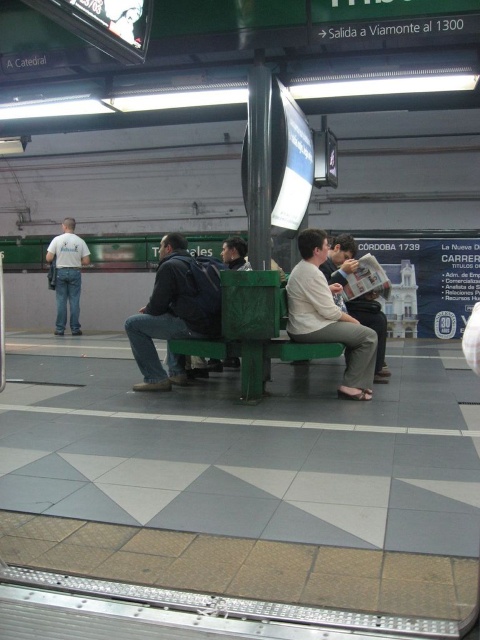
In the scene shown: You are a photographer trying to capture a candid shot of the light blue jeans at left and the light brown leather jacket at center. Since you want to ensure both subjects are in focus, which one should you focus on first to maximize the chances of both being sharp?

The light blue jeans at left is smaller than the light brown leather jacket at center, so focusing on the light brown leather jacket at center first would allow the light blue jeans at left to fall within the depth of field, increasing the likelihood of both being in focus.